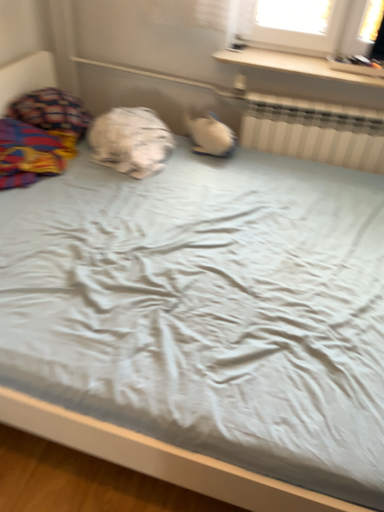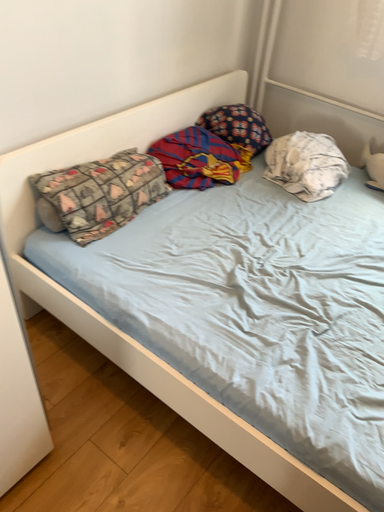
Question: How did the camera likely rotate when shooting the video?

Choices:
 (A) rotated left
 (B) rotated right

Answer: (A)